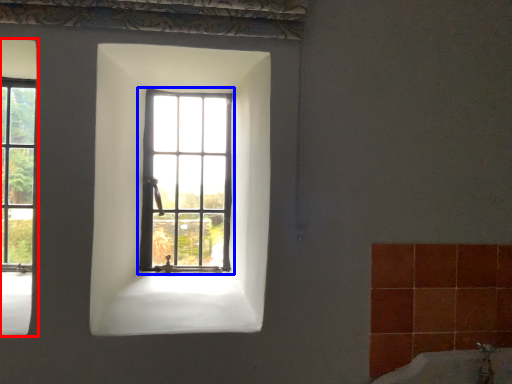
Question: Among these objects, which one is nearest to the camera, window (highlighted by a red box) or window (highlighted by a blue box)?

Choices:
 (A) window
 (B) window

Answer: (A)